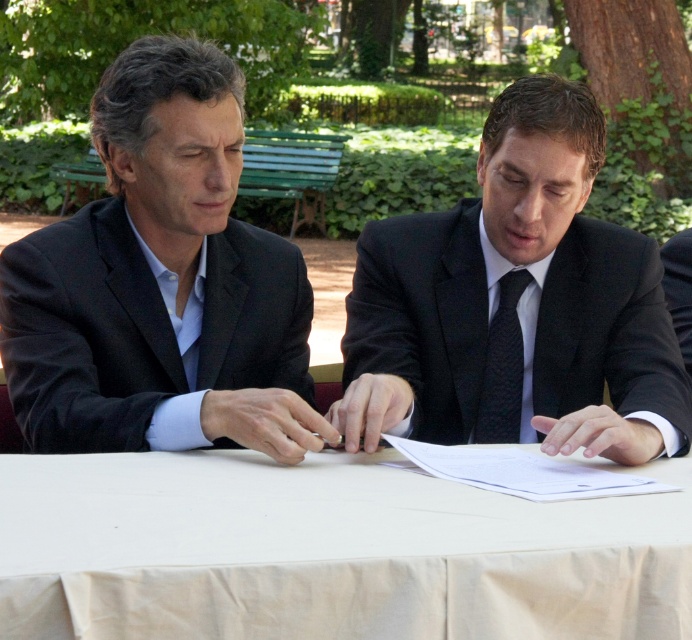
You are a photographer trying to capture a closeup of the black matte suit at center. Based on the coordinates provided in the scene description, where should you position your camera to ensure the suit is the main focus?

The black matte suit at center is located at point coordinates (516,305), so positioning the camera to focus on those coordinates will ensure the suit is the main subject.

You are a photographer positioned behind the two men at the table. You need to capture a clear photo of the black matte suit at center without the black textured tie at center blocking it. Is this possible given their current positions?

The black matte suit at center is in front of the black textured tie at center, so taking a photo from behind them would result in the black matte suit at center blocking the view of the black textured tie at center. However, since you want to capture the black matte suit at center without the black textured tie at center blocking it, this arrangement allows for a clear shot as the tie is behind the suit.

Based on the photo, you are a photographer taking a picture of the scene described. To ensure the black matte suit at left is centered in your photo, what coordinate should you aim for?

The black matte suit at left is located at coordinate point (161, 284), so you should aim your camera at that point to center it in the photo.